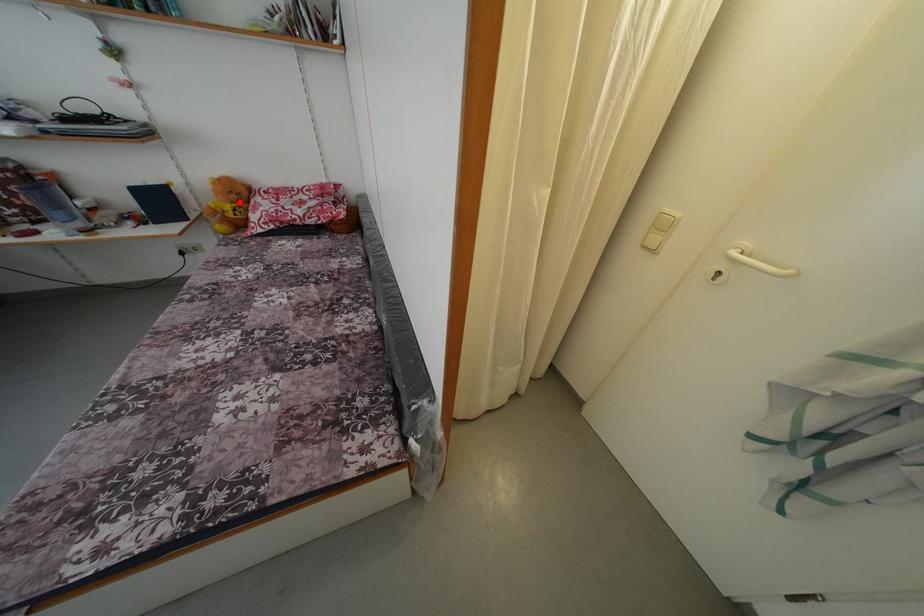
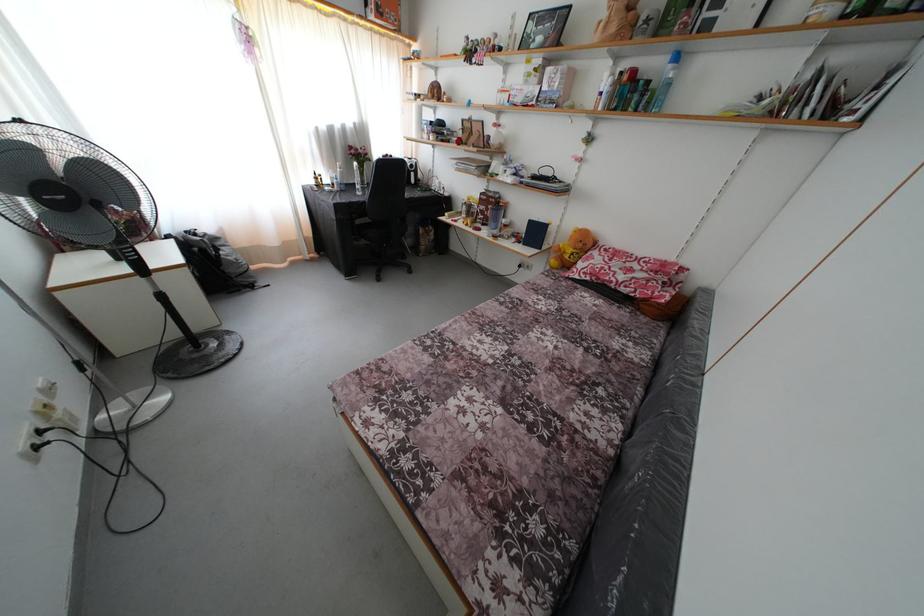
The point at the highlighted location is marked in the first image. Where is the corresponding point in the second image?

(585, 251)